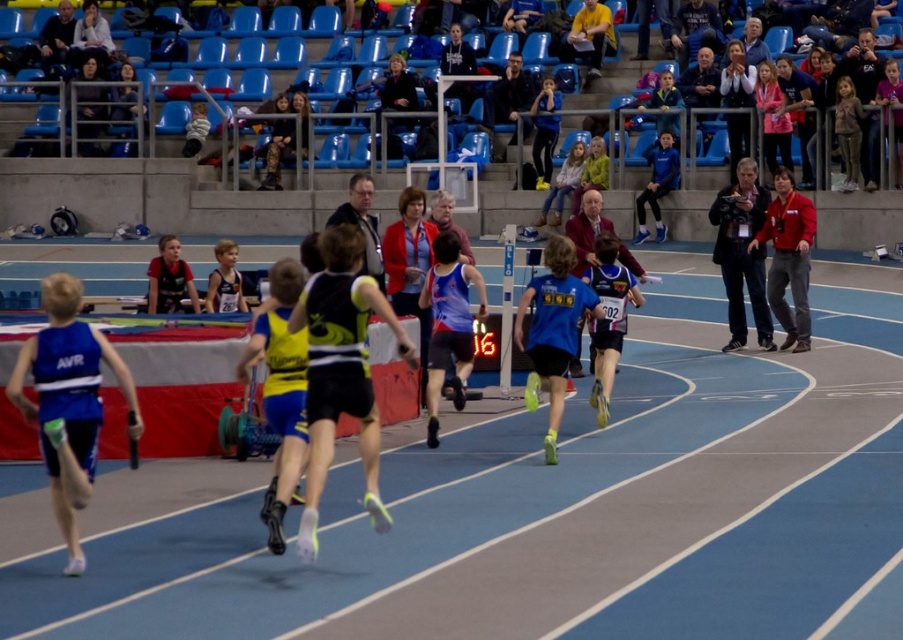
From the picture: Is blue matte running suit at left thinner than blue plastic seats at upper center?

Indeed, blue matte running suit at left has a lesser width compared to blue plastic seats at upper center.

What do you see at coordinates (70, 403) in the screenshot?
I see `blue matte running suit at left` at bounding box center [70, 403].

Where is `blue matte running suit at left`? Image resolution: width=903 pixels, height=640 pixels. blue matte running suit at left is located at coordinates (70, 403).

Can you confirm if blue matte running shoe at center is wider than matte blue running suit at center?

Yes, blue matte running shoe at center is wider than matte blue running suit at center.

Is point (562, 269) less distant than point (441, 234)?

Yes, point (562, 269) is closer to viewer.

Which is behind, point (552, 353) or point (444, 230)?

Positioned behind is point (444, 230).

Image resolution: width=903 pixels, height=640 pixels. What are the coordinates of `blue matte running shoe at center` in the screenshot? It's located at (552, 330).

Looking at this image, who is positioned more to the right, yellow/black mesh running suit at center or blue matte running shoe at center?

blue matte running shoe at center

Who is taller, yellow/black mesh running suit at center or blue matte running shoe at center?

yellow/black mesh running suit at center is taller.

At what (x,y) coordinates should I click in order to perform the action: click on yellow/black mesh running suit at center. Please return your answer as a coordinate pair (x, y). This screenshot has height=640, width=903. Looking at the image, I should click on (281, 390).